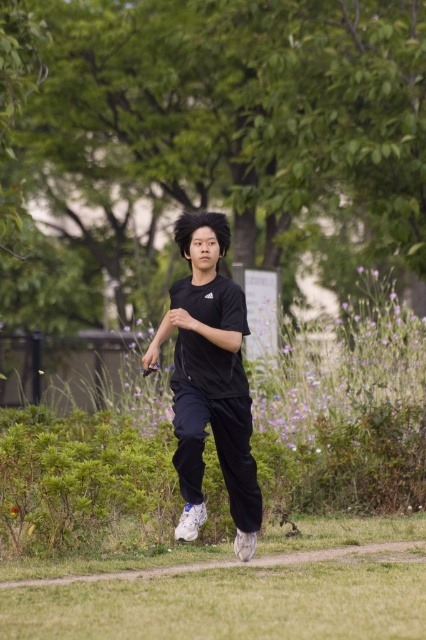
Question: From the image, what is the correct spatial relationship of green grass at lower center in relation to black matte shirt at center?

Choices:
 (A) right
 (B) left

Answer: (A)

Question: Which of the following is the closest to the observer?

Choices:
 (A) (340, 579)
 (B) (221, 344)

Answer: (B)

Question: Is green grass at lower center bigger than black matte shirt at center?

Choices:
 (A) no
 (B) yes

Answer: (A)

Question: Which object appears closest to the camera in this image?

Choices:
 (A) green grass at lower center
 (B) black matte shirt at center

Answer: (B)

Question: Can you confirm if green grass at lower center is positioned above black matte shirt at center?

Choices:
 (A) yes
 (B) no

Answer: (B)